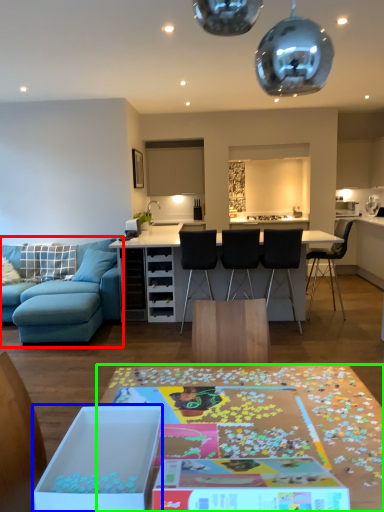
Question: Which is nearer to the studio couch (highlighted by a red box)? cardboard box (highlighted by a blue box) or table (highlighted by a green box).

Choices:
 (A) cardboard box
 (B) table

Answer: (B)